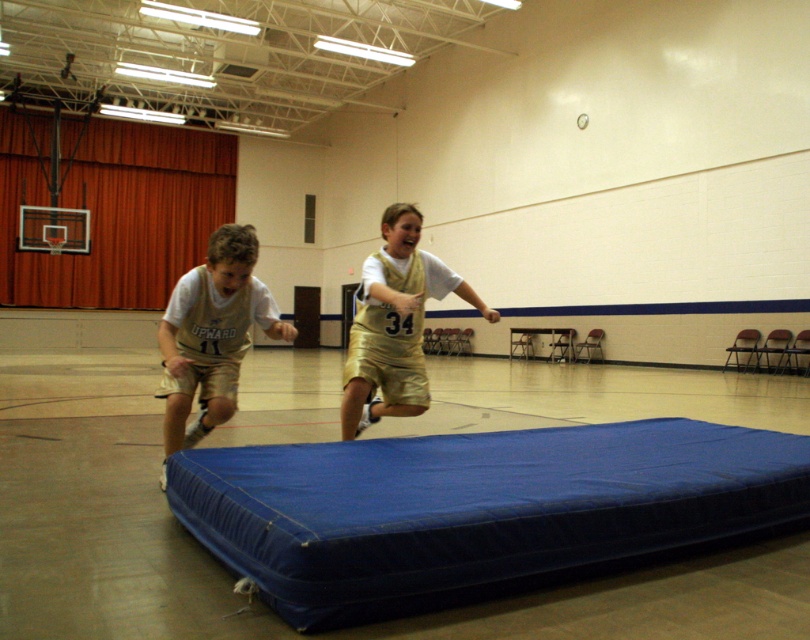
Can you confirm if blue fabric mattress at center is positioned below gold metallic shorts at left?

Yes, blue fabric mattress at center is below gold metallic shorts at left.

The image size is (810, 640). Describe the element at coordinates (480, 509) in the screenshot. I see `blue fabric mattress at center` at that location.

Locate an element on the screen. blue fabric mattress at center is located at coordinates (480, 509).

At what (x,y) coordinates should I click in order to perform the action: click on blue fabric mattress at center. Please return your answer as a coordinate pair (x, y). Image resolution: width=810 pixels, height=640 pixels. Looking at the image, I should click on coord(480,509).

Between point (407, 566) and point (395, 296), which one is positioned behind?

Positioned behind is point (395, 296).

How far apart are blue fabric mattress at center and gold metallic shorts at center?

blue fabric mattress at center and gold metallic shorts at center are 1.80 meters apart from each other.

This screenshot has height=640, width=810. What do you see at coordinates (480, 509) in the screenshot?
I see `blue fabric mattress at center` at bounding box center [480, 509].

The image size is (810, 640). In order to click on blue fabric mattress at center in this screenshot , I will do `click(480, 509)`.

Is gold metallic shorts at left further to camera compared to gold metallic shorts at center?

No, gold metallic shorts at left is in front of gold metallic shorts at center.

Does gold metallic shorts at left have a greater height compared to gold metallic shorts at center?

In fact, gold metallic shorts at left may be shorter than gold metallic shorts at center.

Is point (178, 428) positioned before point (405, 256)?

That is True.

Where is `gold metallic shorts at left`? gold metallic shorts at left is located at coordinates (211, 336).